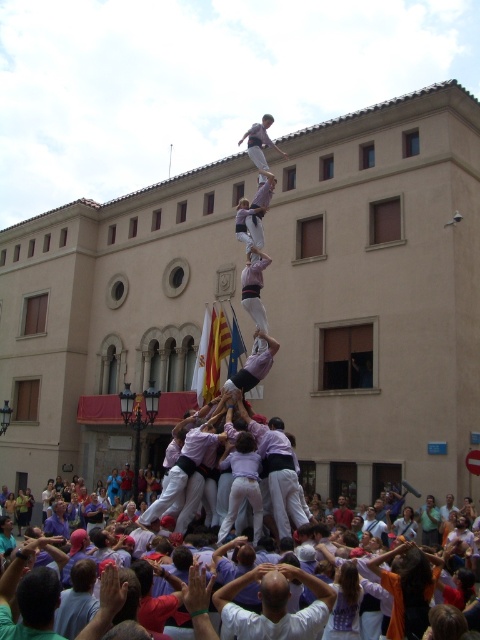
In the scene shown: Who is higher up, white cotton shirt at center or light purple shirt at center?

light purple shirt at center

Looking at this image, which is below, white cotton shirt at center or light purple shirt at center?

white cotton shirt at center is below.

Measure the distance between white cotton shirt at center and camera.

They are 26.00 meters apart.

You are a GUI agent. You are given a task and a screenshot of the screen. Output one action in this format:
    pyautogui.click(x=<x>, y=<y>)
    Task: Click on the white cotton shirt at center
    
    Given the screenshot: What is the action you would take?
    pyautogui.click(x=275, y=604)